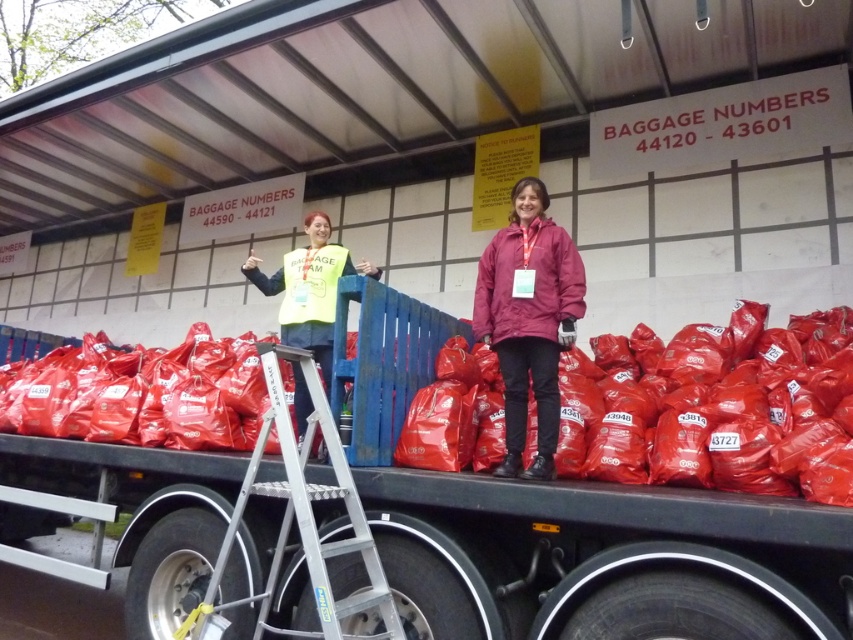
Is silver/aluminum ladder at center shorter than yellow reflective vest at center?

No.

Does silver/aluminum ladder at center appear on the left side of yellow reflective vest at center?

No, silver/aluminum ladder at center is not to the left of yellow reflective vest at center.

Who is more distant from viewer, [306,492] or [369,266]?

Positioned behind is point [369,266].

Locate an element on the screen. Image resolution: width=853 pixels, height=640 pixels. silver/aluminum ladder at center is located at coordinates tap(300, 520).

Who is positioned more to the right, matte maroon jacket at center or yellow reflective vest at center?

matte maroon jacket at center

Does matte maroon jacket at center appear under yellow reflective vest at center?

Yes, matte maroon jacket at center is below yellow reflective vest at center.

Measure the distance between matte maroon jacket at center and camera.

The distance of matte maroon jacket at center from camera is 2.46 meters.

Where is `matte maroon jacket at center`? The image size is (853, 640). matte maroon jacket at center is located at coordinates (529, 320).

Is rubberized plastic bags at center below silver/aluminum ladder at center?

Incorrect, rubberized plastic bags at center is not positioned below silver/aluminum ladder at center.

The height and width of the screenshot is (640, 853). I want to click on rubberized plastic bags at center, so pos(448,493).

Between point (718, 390) and point (241, 502), which one is positioned behind?

Positioned behind is point (718, 390).

Locate an element on the screen. rubberized plastic bags at center is located at coordinates (448, 493).